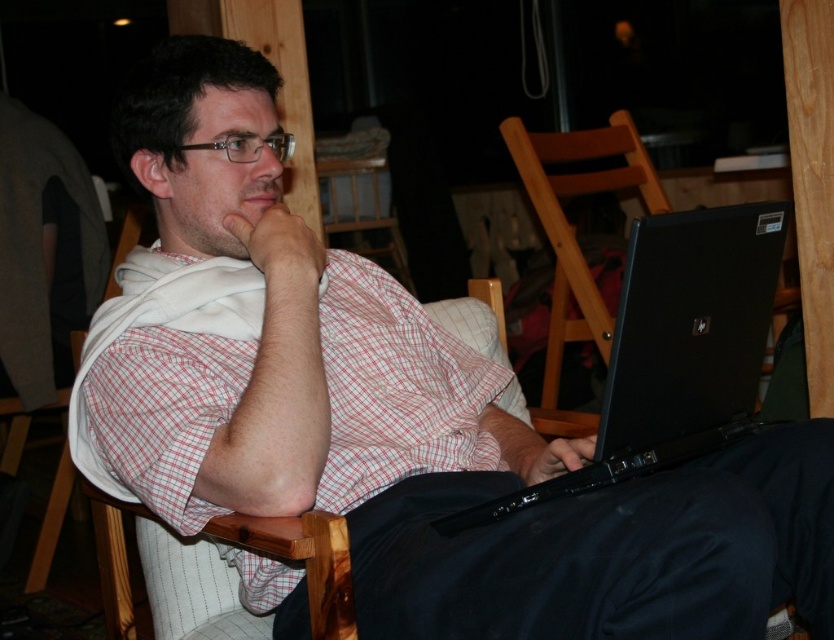
Question: Is white checkered shirt at center positioned at the back of wooden chair at center?

Choices:
 (A) yes
 (B) no

Answer: (B)

Question: Is black matte laptop at lower right positioned at the back of wooden chair at center?

Choices:
 (A) yes
 (B) no

Answer: (B)

Question: Estimate the real-world distances between objects in this image. Which object is farther from the black matte laptop at lower right?

Choices:
 (A) white checkered shirt at center
 (B) wooden chair at center

Answer: (B)

Question: Is white checkered shirt at center above wooden chair at center?

Choices:
 (A) yes
 (B) no

Answer: (B)

Question: Estimate the real-world distances between objects in this image. Which object is closer to the black matte laptop at lower right?

Choices:
 (A) white checkered shirt at center
 (B) wooden chair at center

Answer: (A)

Question: Which point appears farthest from the camera in this image?

Choices:
 (A) (279, 566)
 (B) (505, 141)

Answer: (B)